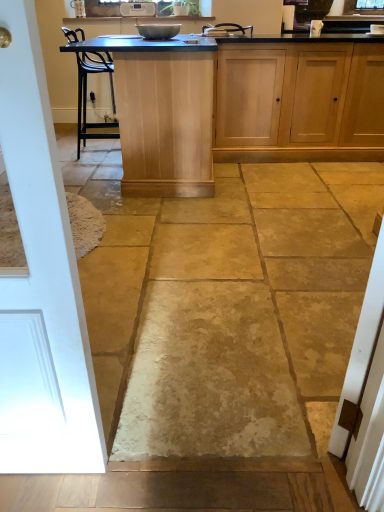
Question: From the image's perspective, would you say light wood cabinet at center is shown under metallic bowl at center?

Choices:
 (A) yes
 (B) no

Answer: (A)

Question: Can you confirm if light wood cabinet at center is wider than metallic bowl at center?

Choices:
 (A) no
 (B) yes

Answer: (B)

Question: Can you confirm if light wood cabinet at center is shorter than metallic bowl at center?

Choices:
 (A) no
 (B) yes

Answer: (A)

Question: Is light wood cabinet at center placed right next to metallic bowl at center?

Choices:
 (A) yes
 (B) no

Answer: (B)

Question: Does light wood cabinet at center have a greater height compared to metallic bowl at center?

Choices:
 (A) no
 (B) yes

Answer: (B)

Question: Which is correct: metallic bowl at center is inside light wood table at center, or outside of it?

Choices:
 (A) outside
 (B) inside

Answer: (A)

Question: Is metallic bowl at center taller or shorter than light wood table at center?

Choices:
 (A) short
 (B) tall

Answer: (A)

Question: From the image's perspective, is metallic bowl at center above or below light wood table at center?

Choices:
 (A) above
 (B) below

Answer: (A)

Question: Is metallic bowl at center in front of or behind light wood table at center in the image?

Choices:
 (A) front
 (B) behind

Answer: (B)

Question: Considering the positions of light wood table at center and light wood cabinet at center in the image, is light wood table at center wider or thinner than light wood cabinet at center?

Choices:
 (A) wide
 (B) thin

Answer: (A)

Question: Relative to light wood cabinet at center, is light wood table at center in front or behind?

Choices:
 (A) front
 (B) behind

Answer: (A)

Question: In terms of height, does light wood table at center look taller or shorter compared to light wood cabinet at center?

Choices:
 (A) short
 (B) tall

Answer: (B)

Question: From a real-world perspective, relative to light wood cabinet at center, is light wood table at center vertically above or below?

Choices:
 (A) above
 (B) below

Answer: (A)

Question: In the image, is white painted wood door at left positioned in front of or behind light wood table at center?

Choices:
 (A) front
 (B) behind

Answer: (A)

Question: Considering the positions of white painted wood door at left and light wood table at center in the image, is white painted wood door at left taller or shorter than light wood table at center?

Choices:
 (A) short
 (B) tall

Answer: (B)